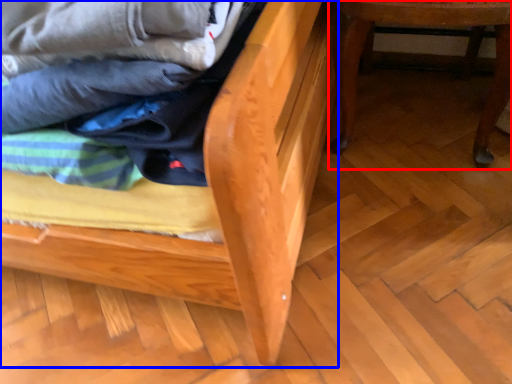
Question: Which object is further to the camera taking this photo, furniture (highlighted by a red box) or furniture (highlighted by a blue box)?

Choices:
 (A) furniture
 (B) furniture

Answer: (A)